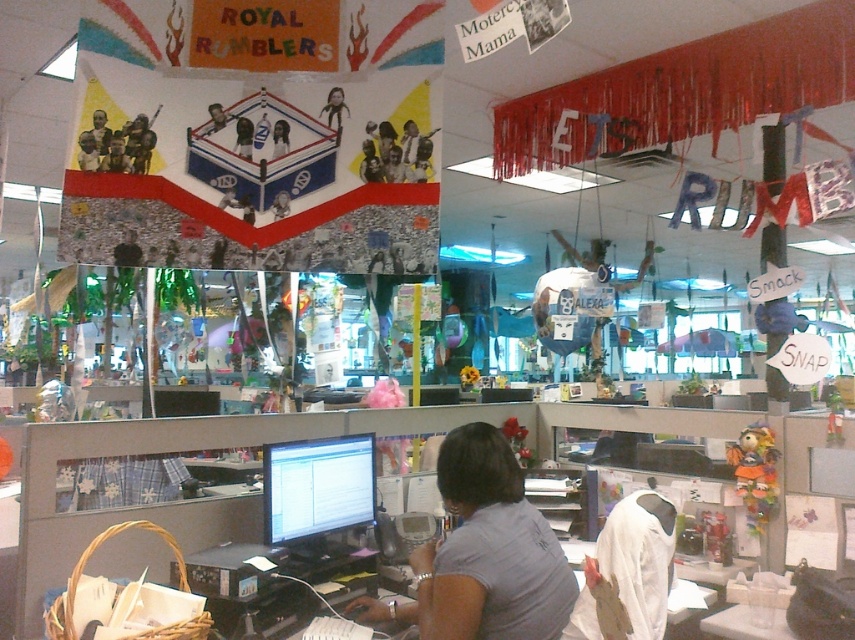
Is gray fabric shirt at center smaller than matte black shirt at center?

No.

Measure the distance from gray fabric shirt at center to matte black shirt at center.

gray fabric shirt at center is 1.28 meters from matte black shirt at center.

I want to click on gray fabric shirt at center, so click(x=485, y=552).

Does matte black helmet at upper center appear on the left side of matte black laptop at upper left?

In fact, matte black helmet at upper center is to the right of matte black laptop at upper left.

Which is above, matte black helmet at upper center or matte black laptop at upper left?

matte black helmet at upper center

Image resolution: width=855 pixels, height=640 pixels. I want to click on matte black helmet at upper center, so click(115, 154).

Can you confirm if matte black monitor at center is taller than matte black shirt at center?

Yes, matte black monitor at center is taller than matte black shirt at center.

Does matte black monitor at center have a larger size compared to matte black shirt at center?

Yes, matte black monitor at center is bigger than matte black shirt at center.

Who is more distant from viewer, (319,484) or (239,122)?

Point (319,484)

Identify the location of matte black monitor at center. Image resolution: width=855 pixels, height=640 pixels. (317, 486).